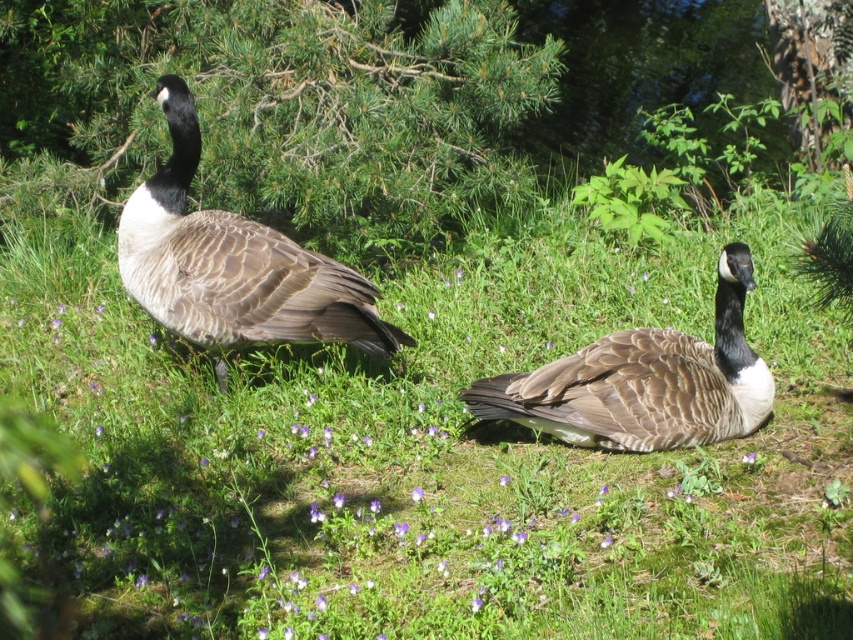
Is green needle-like leaves at upper left positioned before brown feathered goose at center?

No, it is not.

Is green needle-like leaves at upper left thinner than brown feathered goose at center?

No, green needle-like leaves at upper left is not thinner than brown feathered goose at center.

Image resolution: width=853 pixels, height=640 pixels. Identify the location of green needle-like leaves at upper left. (277, 112).

Is brown textured grass at center to the left of brown feathered goose at left from the viewer's perspective?

No, brown textured grass at center is not to the left of brown feathered goose at left.

Who is lower down, brown textured grass at center or brown feathered goose at left?

Positioned lower is brown textured grass at center.

Identify the location of brown textured grass at center. This screenshot has width=853, height=640. (434, 460).

Can you confirm if brown textured grass at center is positioned below brown feathered goose at center?

Incorrect, brown textured grass at center is not positioned below brown feathered goose at center.

What do you see at coordinates (434, 460) in the screenshot?
I see `brown textured grass at center` at bounding box center [434, 460].

Identify the location of brown textured grass at center. This screenshot has height=640, width=853. pyautogui.click(x=434, y=460).